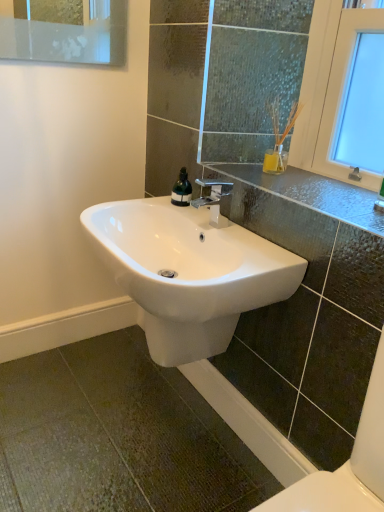
I want to click on vacant space in front of green glass soap dispenser at center, so click(x=195, y=210).